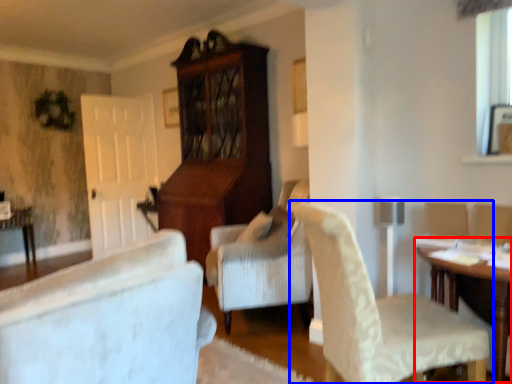
Question: Which object is closer to the camera taking this photo, table (highlighted by a red box) or chair (highlighted by a blue box)?

Choices:
 (A) table
 (B) chair

Answer: (B)